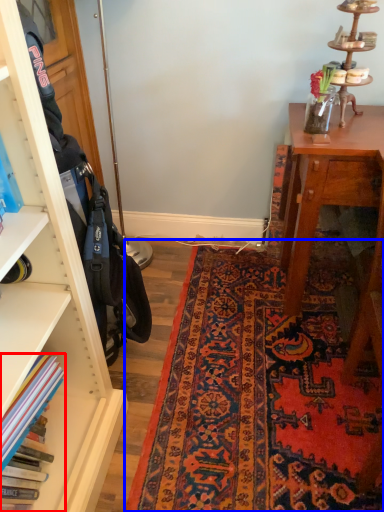
Question: Which object is further to the camera taking this photo, book (highlighted by a red box) or mat (highlighted by a blue box)?

Choices:
 (A) book
 (B) mat

Answer: (B)